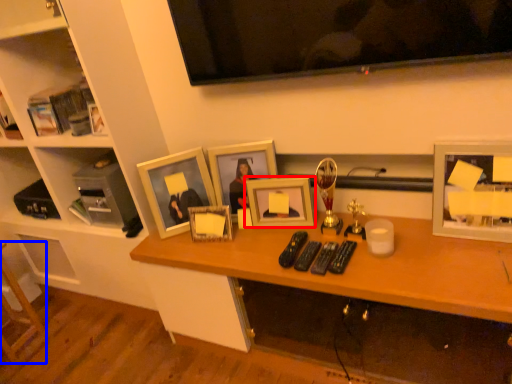
Question: Which object is closer to the camera taking this photo, picture frame (highlighted by a red box) or furniture (highlighted by a blue box)?

Choices:
 (A) picture frame
 (B) furniture

Answer: (A)